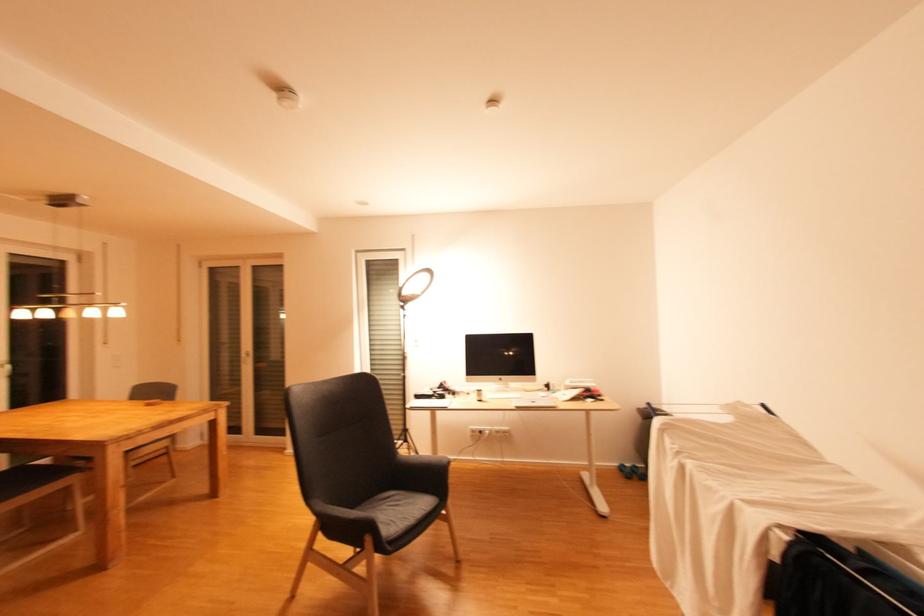
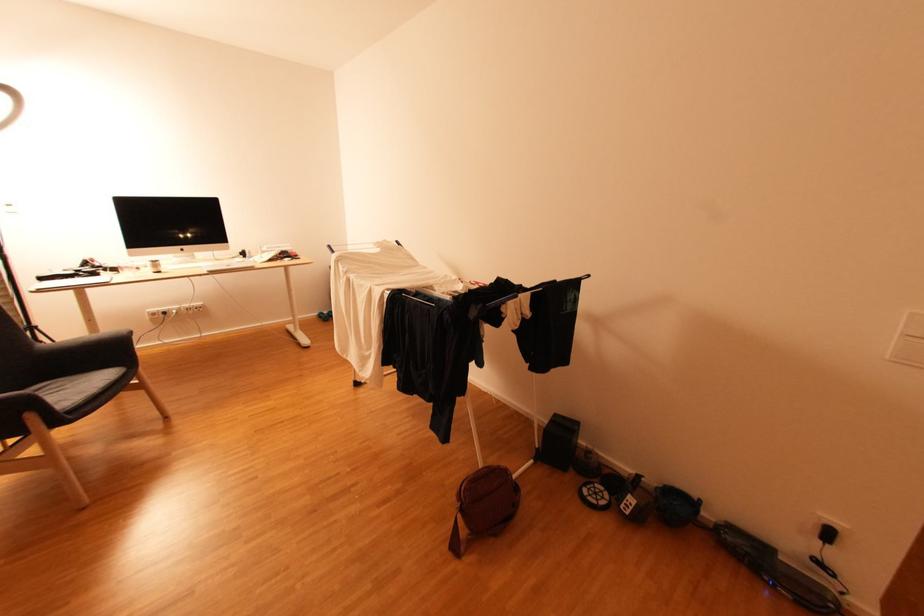
Based on the continuous images, in which direction is the camera rotating?

The camera's rotation is toward right-down.